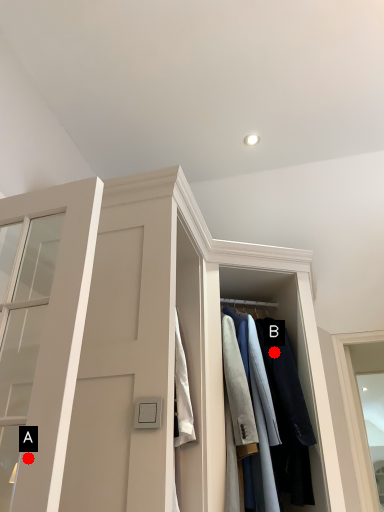
Question: Two points are circled on the image, labeled by A and B beside each circle. Among these points, which one is farthest from the camera?

Choices:
 (A) A is further
 (B) B is further

Answer: (B)